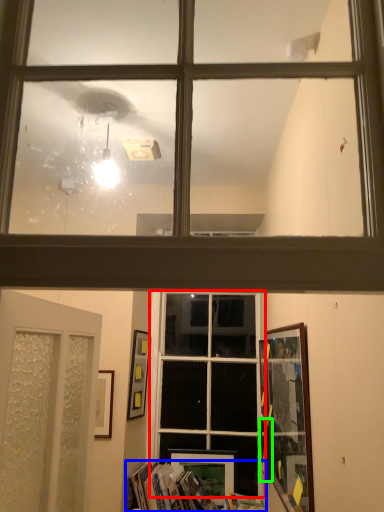
Question: Based on their relative distances, which object is farther from window (highlighted by a red box)? Choose from book (highlighted by a blue box) and picture frame (highlighted by a green box).

Choices:
 (A) book
 (B) picture frame

Answer: (B)